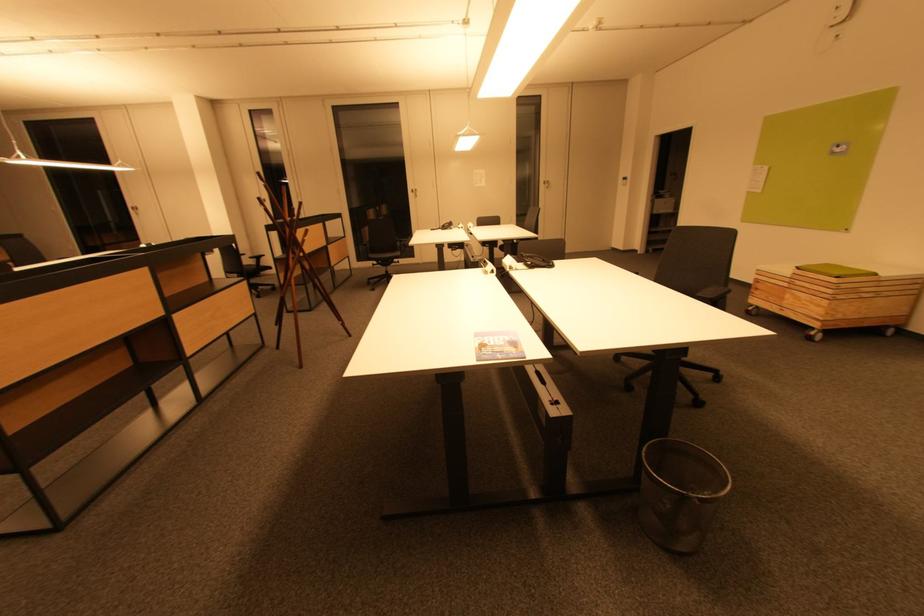
Where would you lift the black office phone? Please return your answer as a coordinate pair (x, y).

(537, 261)